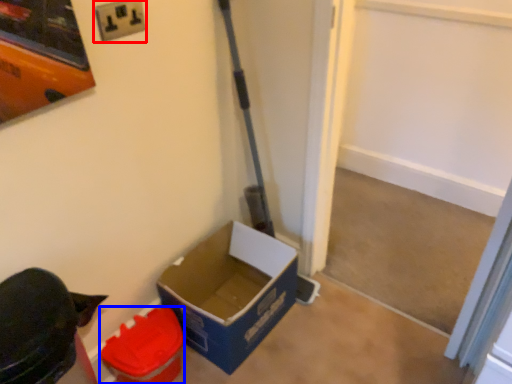
Question: Which of the following is the closest to the observer, electric outlet (highlighted by a red box) or box (highlighted by a blue box)?

Choices:
 (A) electric outlet
 (B) box

Answer: (A)